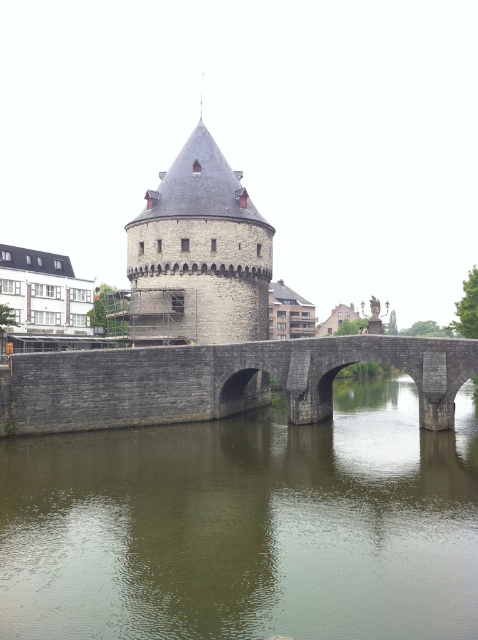
Based on the photo, is greenish stone water at center bigger than gray stone bridge at center?

Incorrect, greenish stone water at center is not larger than gray stone bridge at center.

Between greenish stone water at center and gray stone bridge at center, which one appears on the right side from the viewer's perspective?

gray stone bridge at center

Does point (325, 579) come farther from viewer compared to point (76, 417)?

That is False.

You are a GUI agent. You are given a task and a screenshot of the screen. Output one action in this format:
    pyautogui.click(x=<x>, y=<y>)
    Task: Click on the greenish stone water at center
    The image size is (478, 640).
    Given the screenshot: What is the action you would take?
    pyautogui.click(x=247, y=525)

Can you confirm if gray stone bridge at center is wider than gray stone tower at center?

Correct, the width of gray stone bridge at center exceeds that of gray stone tower at center.

Is gray stone bridge at center further to the viewer compared to gray stone tower at center?

That is False.

I want to click on gray stone bridge at center, so click(217, 381).

Where is `gray stone bridge at center`? gray stone bridge at center is located at coordinates (217, 381).

Can you confirm if greenish stone water at center is wider than gray stone tower at center?

Yes, greenish stone water at center is wider than gray stone tower at center.

Is greenish stone water at center bigger than gray stone tower at center?

Incorrect, greenish stone water at center is not larger than gray stone tower at center.

Which is in front, point (184, 432) or point (246, 250)?

Point (184, 432) is more forward.

Where is `greenish stone water at center`? This screenshot has height=640, width=478. greenish stone water at center is located at coordinates (247, 525).